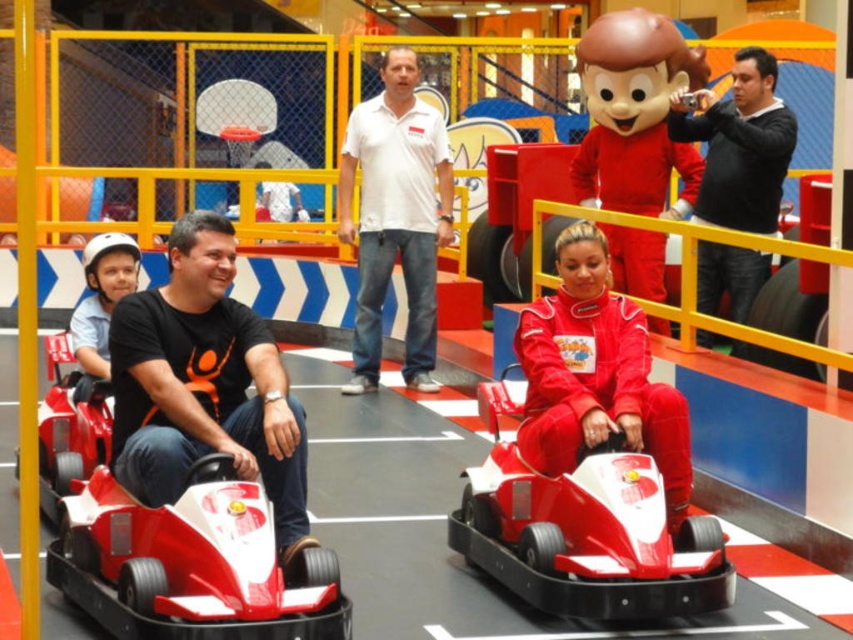
Question: Which point appears closest to the camera in this image?

Choices:
 (A) (397, 90)
 (B) (303, 609)

Answer: (B)

Question: Is white cotton shirt at center smaller than matte black helmet at left?

Choices:
 (A) no
 (B) yes

Answer: (A)

Question: Which point is closer to the camera?

Choices:
 (A) shiny red race car at center
 (B) matte red mascot at center

Answer: (A)

Question: Which of the following is the farthest from the observer?

Choices:
 (A) (437, 125)
 (B) (534, 449)

Answer: (A)

Question: Does shiny red race car at center appear under matte black helmet at left?

Choices:
 (A) yes
 (B) no

Answer: (A)

Question: Is shiny red race car at center below white cotton shirt at center?

Choices:
 (A) yes
 (B) no

Answer: (A)